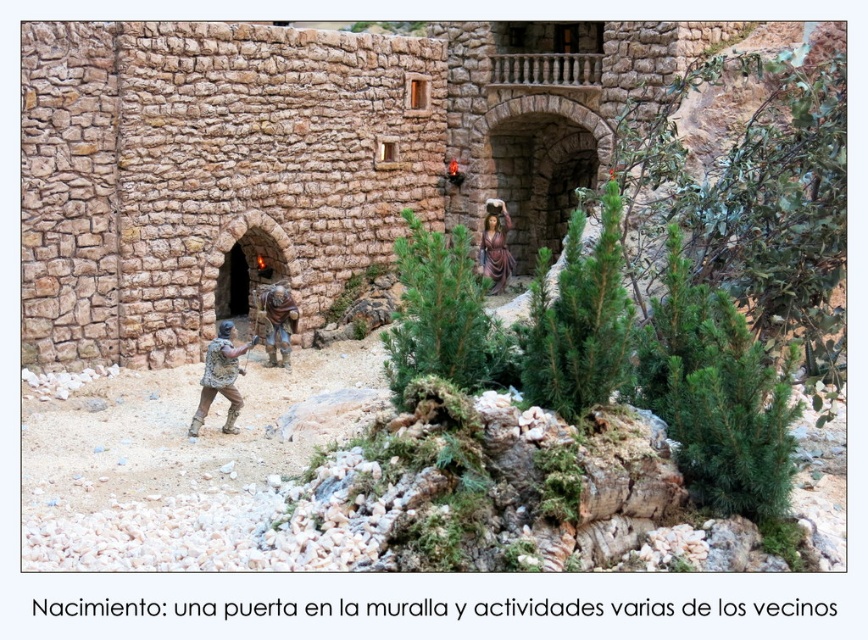
Is point (233, 365) positioned behind point (490, 220)?

No, it is in front of (490, 220).

Between point (240, 397) and point (497, 260), which one is positioned behind?

Point (497, 260)

This screenshot has width=868, height=640. What are the coordinates of `matte brown armor at center` in the screenshot? It's located at (220, 378).

Which of these two, matte brown armor at center or brown fabric figure at center, stands taller?

Standing taller between the two is matte brown armor at center.

Is point (229, 420) farther from camera compared to point (266, 337)?

No, (229, 420) is in front of (266, 337).

The width and height of the screenshot is (868, 640). I want to click on matte brown armor at center, so (x=220, y=378).

Who is shorter, brown stone wall at center or matte brown statue at center?

With less height is matte brown statue at center.

Between brown stone wall at center and matte brown statue at center, which one is positioned higher?

brown stone wall at center is above.

Find the location of a particular element. Image resolution: width=868 pixels, height=640 pixels. brown stone wall at center is located at coordinates (301, 156).

Identify the location of brown stone wall at center. This screenshot has height=640, width=868. (301, 156).